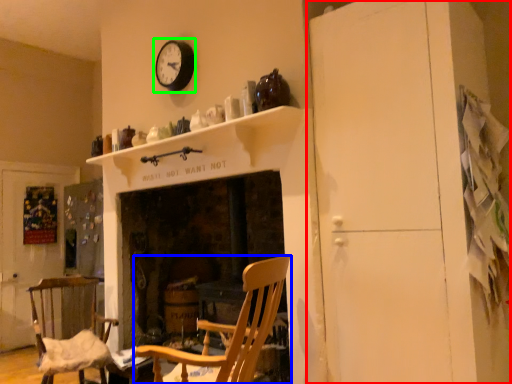
Question: Which is farther away from dresser (highlighted by a red box)? chair (highlighted by a blue box) or clock (highlighted by a green box)?

Choices:
 (A) chair
 (B) clock

Answer: (B)